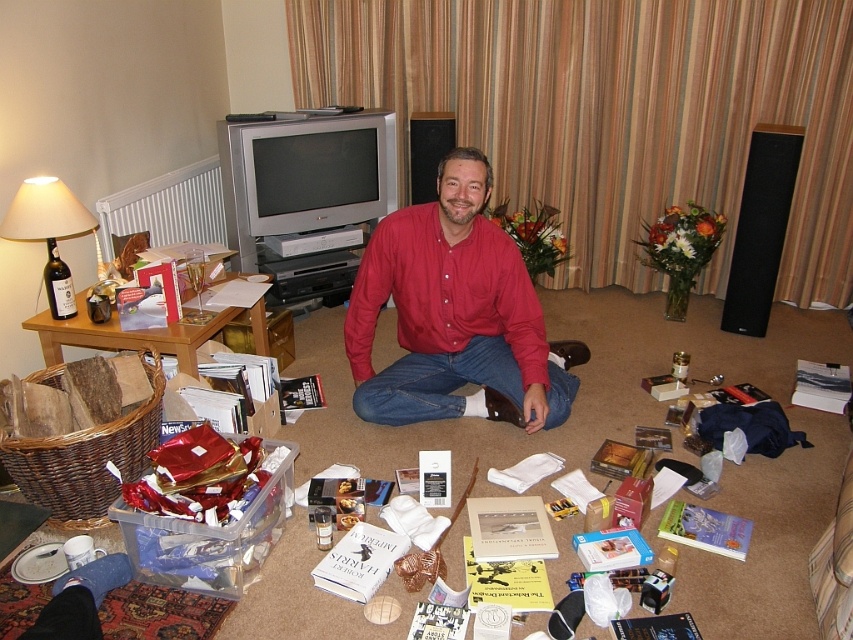
Is point (401, 285) positioned behind point (50, 310)?

Yes, it is behind point (50, 310).

Which of these two, red cotton shirt at center or matte beige lampshade at left, stands taller?

With more height is red cotton shirt at center.

What are the coordinates of `red cotton shirt at center` in the screenshot? It's located at (451, 310).